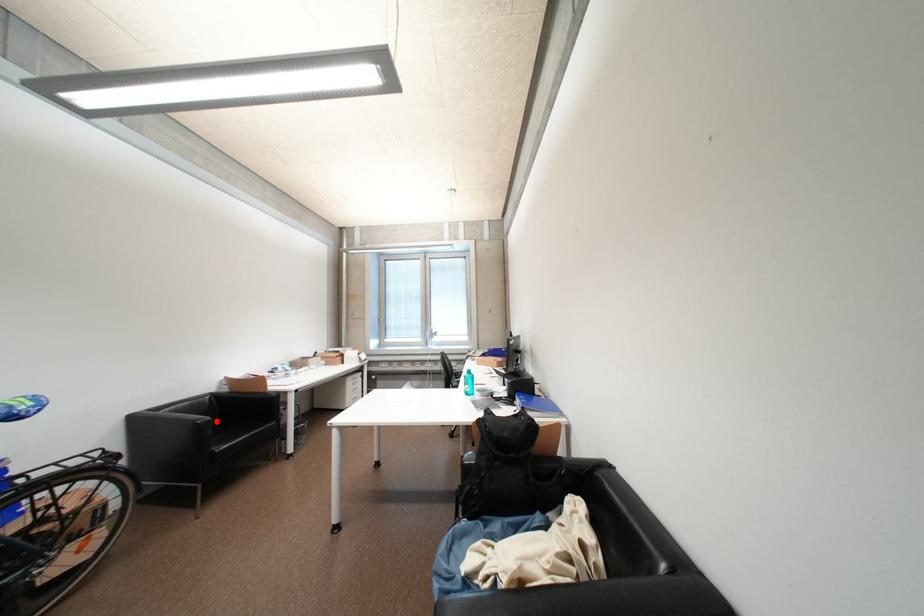
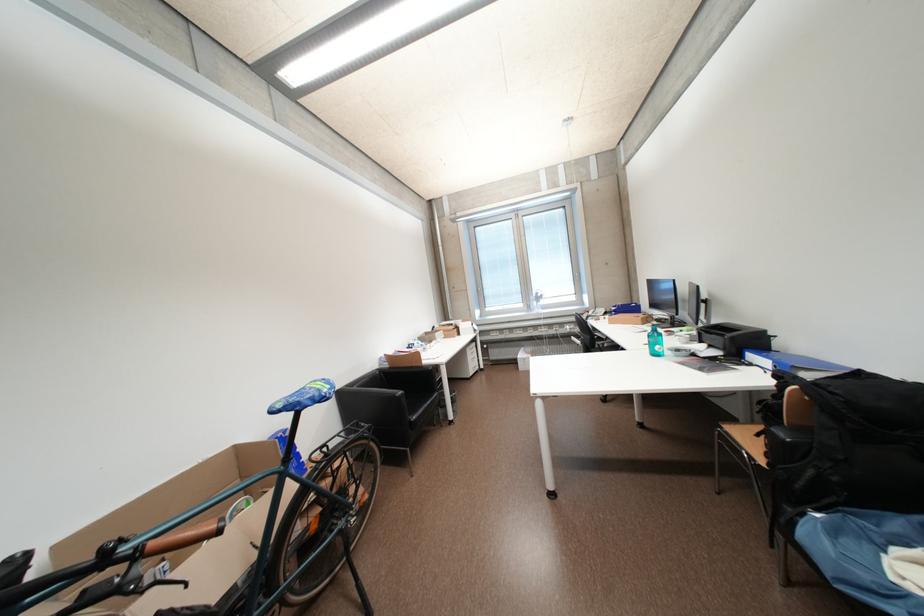
Where in the second image is the point corresponding to the highlighted location from the first image?

(408, 394)